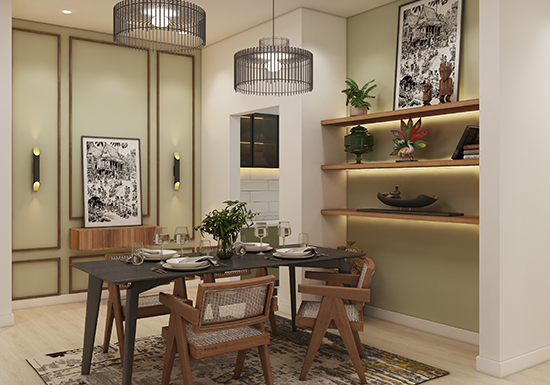
You are a GUI agent. You are given a task and a screenshot of the screen. Output one action in this format:
    pyautogui.click(x=<x>, y=<y>)
    Task: Click on the chairs
    This screenshot has height=385, width=550.
    Given the screenshot: What is the action you would take?
    pyautogui.click(x=232, y=328), pyautogui.click(x=338, y=318), pyautogui.click(x=148, y=306), pyautogui.click(x=254, y=273)